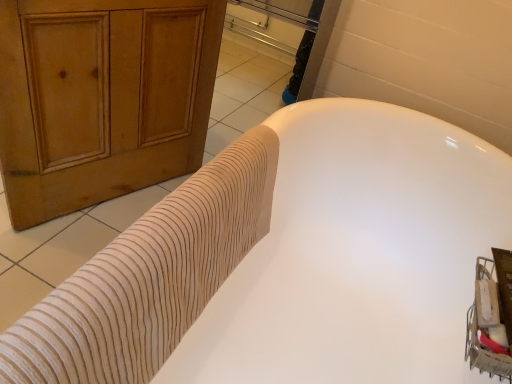
Question: Should I look upward or downward to see white ribbed tub at center?

Choices:
 (A) up
 (B) down

Answer: (B)

Question: From a real-world perspective, is beige textured towel at upper left below white ribbed tub at center?

Choices:
 (A) no
 (B) yes

Answer: (A)

Question: Is beige textured towel at upper left taller than white ribbed tub at center?

Choices:
 (A) no
 (B) yes

Answer: (A)

Question: Is beige textured towel at upper left aimed at white ribbed tub at center?

Choices:
 (A) no
 (B) yes

Answer: (B)

Question: Can you confirm if beige textured towel at upper left is bigger than white ribbed tub at center?

Choices:
 (A) no
 (B) yes

Answer: (A)

Question: Is beige textured towel at upper left located outside white ribbed tub at center?

Choices:
 (A) no
 (B) yes

Answer: (A)

Question: Are beige textured towel at upper left and white ribbed tub at center far apart?

Choices:
 (A) no
 (B) yes

Answer: (A)

Question: From a real-world perspective, is white ribbed tub at center below beige textured towel at upper left?

Choices:
 (A) yes
 (B) no

Answer: (A)

Question: Can you confirm if white ribbed tub at center is wider than beige textured towel at upper left?

Choices:
 (A) yes
 (B) no

Answer: (A)

Question: Is white ribbed tub at center shorter than beige textured towel at upper left?

Choices:
 (A) no
 (B) yes

Answer: (A)

Question: Is white ribbed tub at center next to beige textured towel at upper left?

Choices:
 (A) no
 (B) yes

Answer: (A)

Question: Does white ribbed tub at center turn towards beige textured towel at upper left?

Choices:
 (A) yes
 (B) no

Answer: (A)

Question: Is white ribbed tub at center bigger than beige textured towel at upper left?

Choices:
 (A) yes
 (B) no

Answer: (A)

Question: Considering their positions, is white ribbed tub at center located in front of or behind beige textured towel at upper left?

Choices:
 (A) behind
 (B) front

Answer: (B)